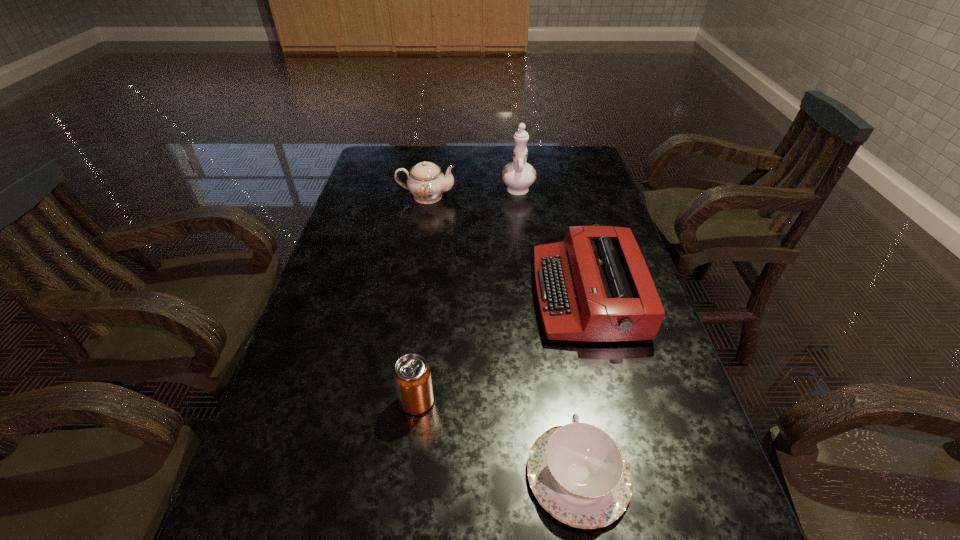
You are a GUI agent. You are given a task and a screenshot of the screen. Output one action in this format:
    pyautogui.click(x=<x>, y=<y>)
    Task: Click on the vacant space situated on the right of the soda can
    
    Given the screenshot: What is the action you would take?
    pyautogui.click(x=595, y=401)

Find the location of a particular element. This screenshot has width=960, height=540. blank space located 0.050m on the typing side of the typewriter is located at coordinates (516, 295).

You are a GUI agent. You are given a task and a screenshot of the screen. Output one action in this format:
    pyautogui.click(x=<x>, y=<y>)
    Task: Click on the free space located on the typing side of the typewriter
    
    Given the screenshot: What is the action you would take?
    pyautogui.click(x=387, y=295)

Locate an element on the screen. vacant position located 0.180m on the typing side of the typewriter is located at coordinates tap(465, 295).

You are a GUI agent. You are given a task and a screenshot of the screen. Output one action in this format:
    pyautogui.click(x=<x>, y=<y>)
    Task: Click on the vacant area located on the handle side of the nearest chinaware
    The image size is (960, 540).
    Given the screenshot: What is the action you would take?
    pyautogui.click(x=553, y=321)

Find the location of a particular element. vacant space located on the handle side of the nearest chinaware is located at coordinates (564, 393).

You are a GUI agent. You are given a task and a screenshot of the screen. Output one action in this format:
    pyautogui.click(x=<x>, y=<y>)
    Task: Click on the vacant space located on the handle side of the nearest chinaware
    This screenshot has width=960, height=540.
    Given the screenshot: What is the action you would take?
    (565, 397)

I want to click on object at the far edge, so click(x=518, y=175).

This screenshot has height=540, width=960. Identify the location of object that is positioned at the left edge. (426, 182).

Locate an element on the screen. The height and width of the screenshot is (540, 960). typewriter that is at the right edge is located at coordinates (595, 286).